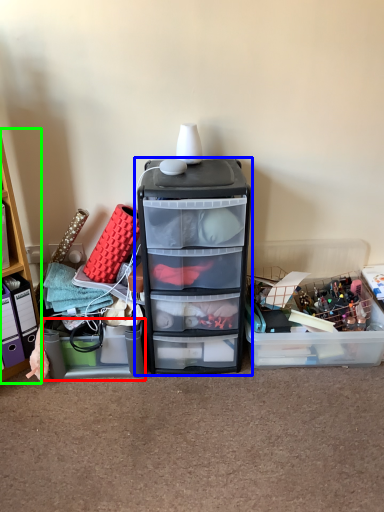
Question: Which is nearer to the storage box (highlighted by a red box)? filing cabinet (highlighted by a blue box) or cabinetry (highlighted by a green box).

Choices:
 (A) filing cabinet
 (B) cabinetry

Answer: (B)